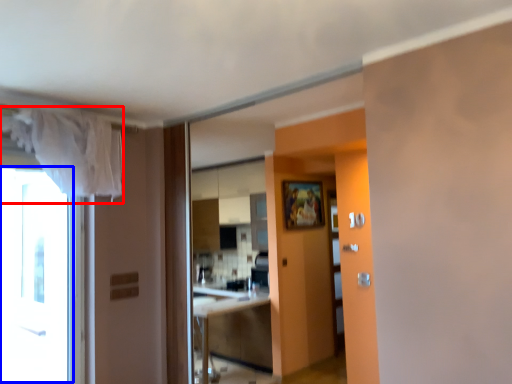
Question: Which object is further to the camera taking this photo, curtain (highlighted by a red box) or window (highlighted by a blue box)?

Choices:
 (A) curtain
 (B) window

Answer: (B)